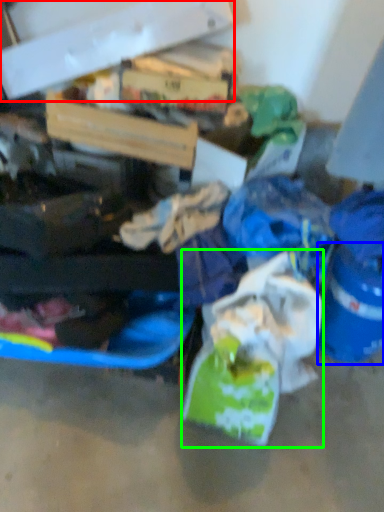
Question: Which object is positioned farthest from box (highlighted by a red box)? Select from bucket (highlighted by a blue box) and plastic bag (highlighted by a green box).

Choices:
 (A) bucket
 (B) plastic bag

Answer: (A)